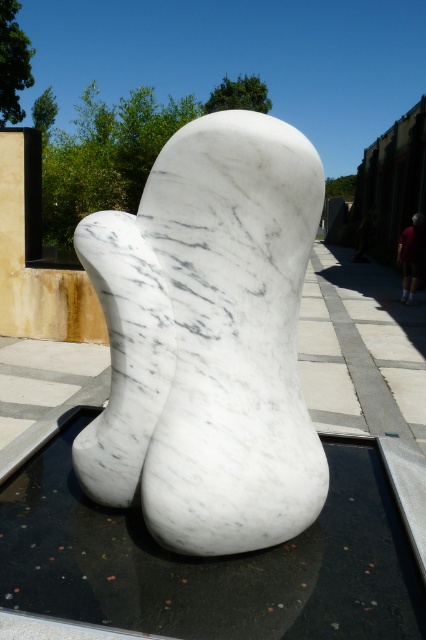
You are standing in front of the sculpture and want to take a photo of both the white marble sculpture at center and the dark blue jeans at right. Which object should you focus on first to ensure both are in focus?

You should focus on the white marble sculpture at center first because it is closer to you than the dark blue jeans at right, so adjusting focus from near to far will help both be in focus.

You are an artist planning to create a new installation in the same space as the white marble sculpture at center and the dark blue jeans at right. You need to know which object takes up more area so you can plan accordingly. Which object requires more space in the area?

The dark blue jeans at right requires more space because the white marble sculpture at center occupies less space than dark blue jeans at right.

You are an art curator planning to install a new light fixture above the white marble sculpture at center and the white marble water at center. The light fixture needs to be placed high enough to avoid casting shadows on both objects. Given that the sculpture is much taller than the water, where should you position the light fixture?

The white marble sculpture at center is much taller than the white marble water at center, so the light fixture should be positioned above the sculpture at a height that accommodates its greater height to avoid casting shadows on both objects.